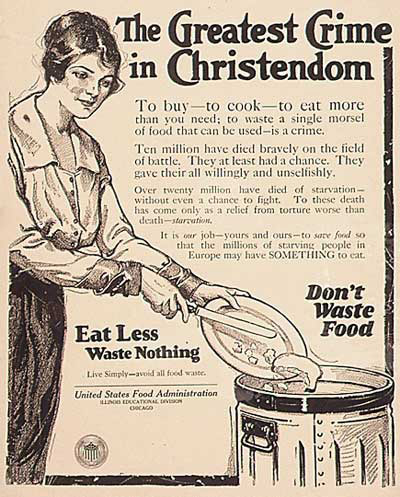
In order to click on garbage can in this screenshot , I will do `click(332, 427)`.